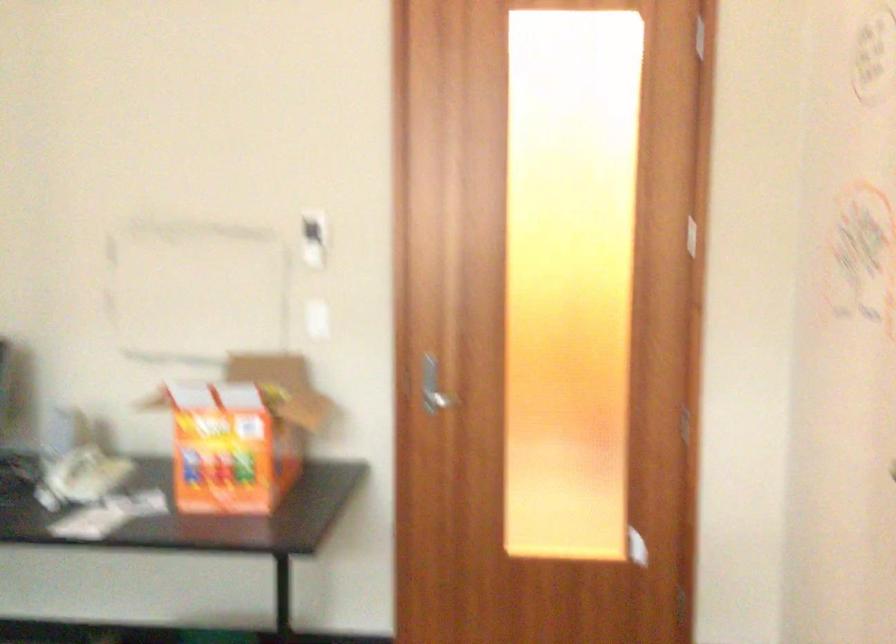
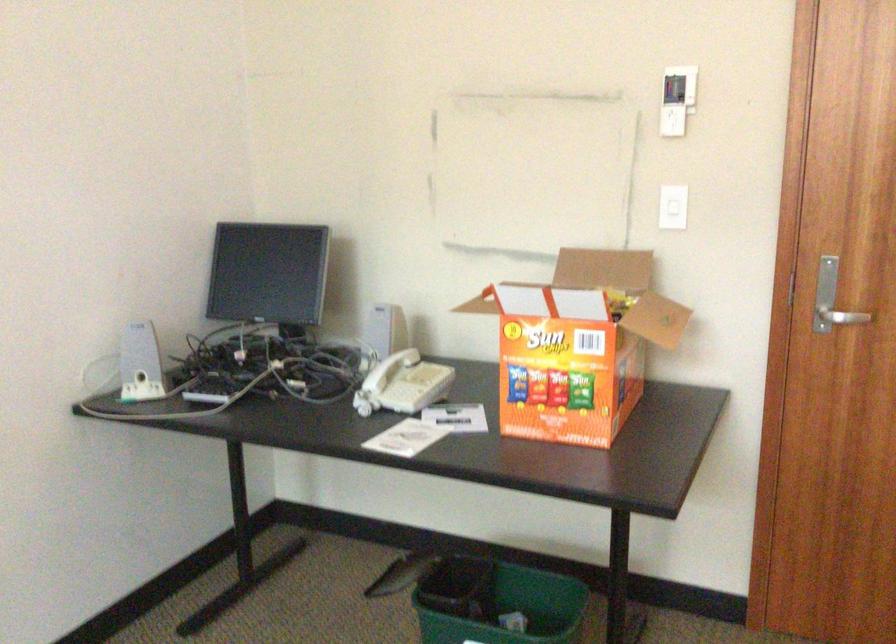
Where in the second image is the point corresponding to (240,428) from the first image?

(578, 345)